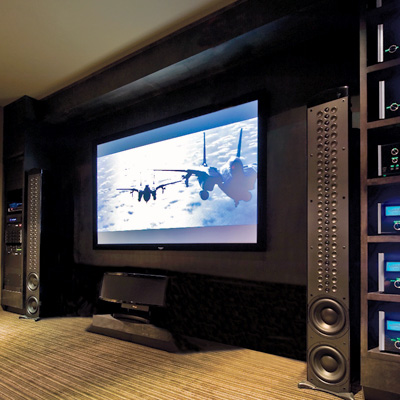
The width and height of the screenshot is (400, 400). I want to click on desktop computer, so click(8, 234).